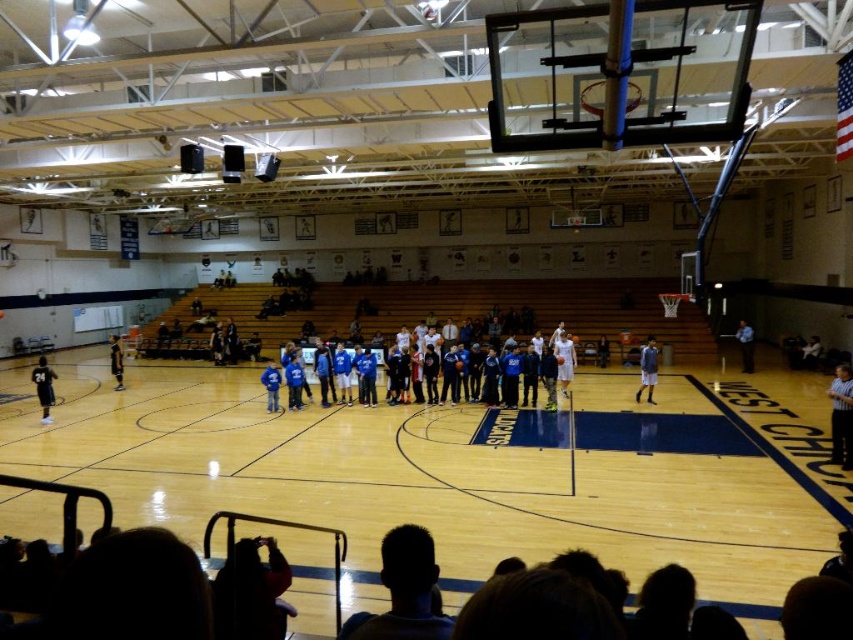
Question: Which point appears closest to the camera in this image?

Choices:
 (A) (119, 364)
 (B) (834, 403)
 (C) (276, 412)
 (D) (36, 365)

Answer: (B)

Question: Among these points, which one is farthest from the camera?

Choices:
 (A) (747, 339)
 (B) (642, 384)
 (C) (282, 324)

Answer: (C)

Question: Does white matte basketball player at center appear on the right side of blue fleece jacket at center?

Choices:
 (A) no
 (B) yes

Answer: (B)

Question: Can you confirm if white shirt at center is positioned below blue fleece jacket at center?

Choices:
 (A) yes
 (B) no

Answer: (A)

Question: Does blue jersey at center have a smaller size compared to gray fabric jacket at lower right?

Choices:
 (A) no
 (B) yes

Answer: (A)

Question: Which of the following is the closest to the observer?

Choices:
 (A) (47, 372)
 (B) (640, 380)

Answer: (A)